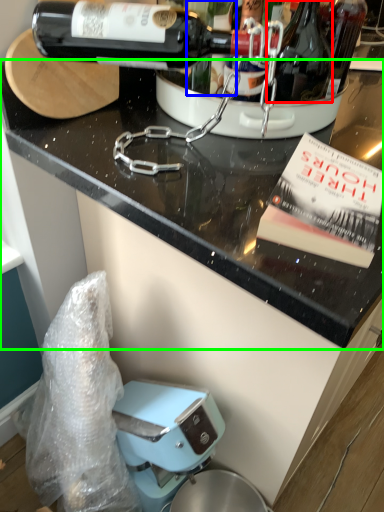
Question: Based on their relative distances, which object is farther from bottle (highlighted by a red box)? Choose from wine (highlighted by a blue box) and countertop (highlighted by a green box).

Choices:
 (A) wine
 (B) countertop

Answer: (B)